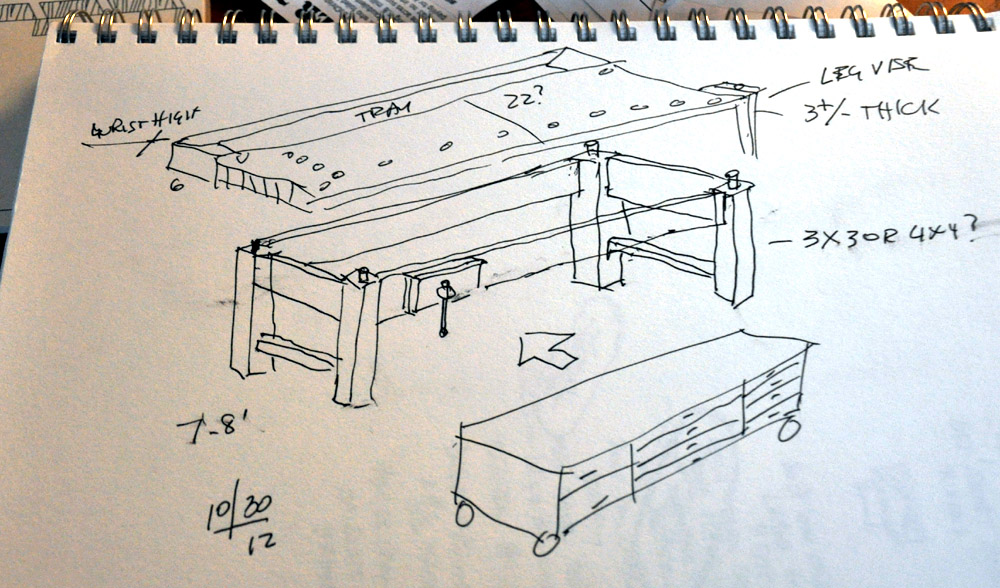
The height and width of the screenshot is (588, 1000). I want to click on furniture legs, so click(x=731, y=280), click(x=604, y=270), click(x=350, y=374), click(x=251, y=337), click(x=748, y=123).